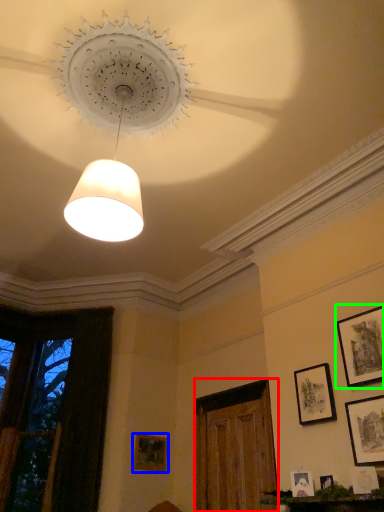
Question: Which object is the farthest from glass door (highlighted by a red box)? Choose among these: picture frame (highlighted by a blue box) or picture frame (highlighted by a green box).

Choices:
 (A) picture frame
 (B) picture frame

Answer: (B)